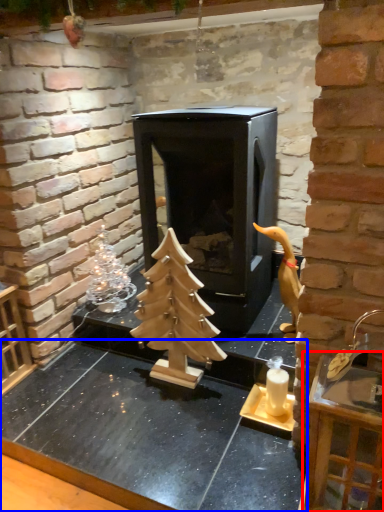
Question: Which point is closer to the camera, furniture (highlighted by a red box) or counter top (highlighted by a blue box)?

Choices:
 (A) furniture
 (B) counter top

Answer: (A)